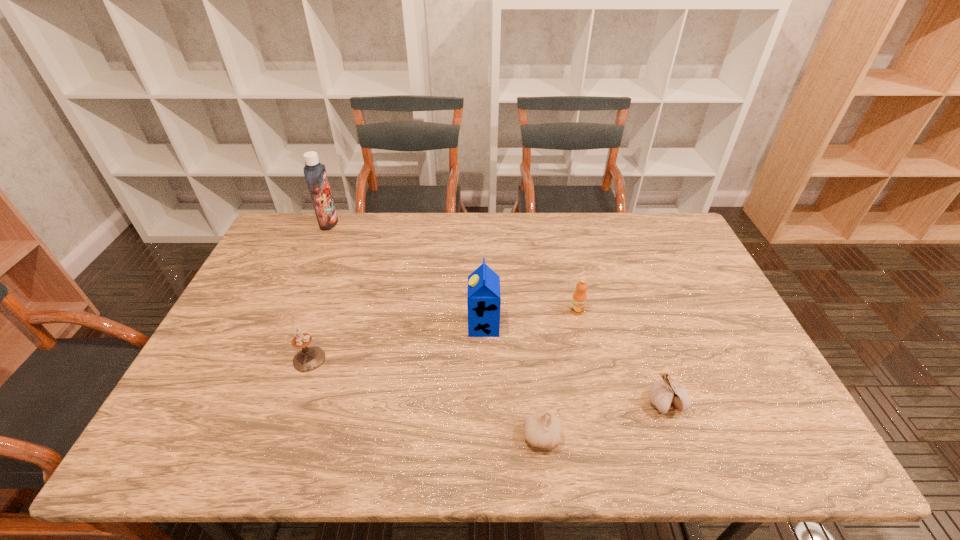
I want to click on free space that is in between the nearest object and the rightmost object, so click(x=603, y=420).

I want to click on free spot between the third object from right to left and the leftmost object, so click(x=436, y=329).

This screenshot has height=540, width=960. Find the location of `free spot between the leftmost object and the shorter garlic`. free spot between the leftmost object and the shorter garlic is located at coordinates (436, 329).

This screenshot has height=540, width=960. In order to click on vacant area between the second nearest object and the orange juice in this screenshot , I will do `click(621, 357)`.

Where is `free space between the nearer garlic and the candle holder`? free space between the nearer garlic and the candle holder is located at coordinates (425, 397).

Image resolution: width=960 pixels, height=540 pixels. What are the coordinates of `vacant area that lies between the farther garlic and the orange juice` in the screenshot? It's located at (621, 357).

I want to click on object that is the closest to the tallest object, so click(x=309, y=358).

Point out which object is positioned as the fifth nearest to the second object from left to right. Please provide its 2D coordinates. Your answer should be formatted as a tuple, i.e. [(x, y)], where the tuple contains the x and y coordinates of a point satisfying the conditions above.

[(666, 394)]

Locate an element on the screen. This screenshot has width=960, height=540. vacant space that satisfies the following two spatial constraints: 1. on the front label of the orange juice; 2. with the cap open on the third object from left to right is located at coordinates (581, 326).

Image resolution: width=960 pixels, height=540 pixels. Find the location of `free space in the image that satisfies the following two spatial constraints: 1. on the back side of the candle holder; 2. on the front label of the shampoo`. free space in the image that satisfies the following two spatial constraints: 1. on the back side of the candle holder; 2. on the front label of the shampoo is located at coordinates (358, 223).